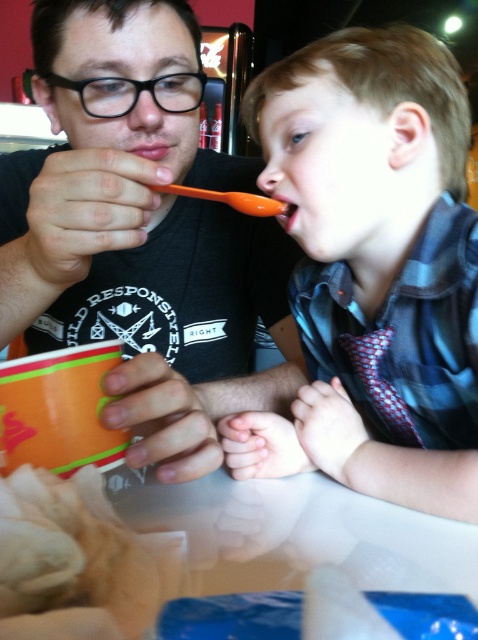
Question: Is matte black shirt at center thinner than matte orange spoon at mouth?

Choices:
 (A) yes
 (B) no

Answer: (B)

Question: Can you confirm if matte black shirt at center is bigger than matte orange spoon at mouth?

Choices:
 (A) no
 (B) yes

Answer: (B)

Question: Is matte orange spoon at upper right bigger than matte orange spoon at mouth?

Choices:
 (A) yes
 (B) no

Answer: (A)

Question: Which point is farther to the camera?

Choices:
 (A) (136, 148)
 (B) (39, 72)

Answer: (B)

Question: Among these objects, which one is nearest to the camera?

Choices:
 (A) matte skin at center
 (B) matte black shirt at center
 (C) matte orange spoon at upper right
 (D) matte orange spoon at mouth

Answer: (B)

Question: Which of the following is the closest to the observer?

Choices:
 (A) matte skin at center
 (B) matte orange spoon at upper right

Answer: (B)